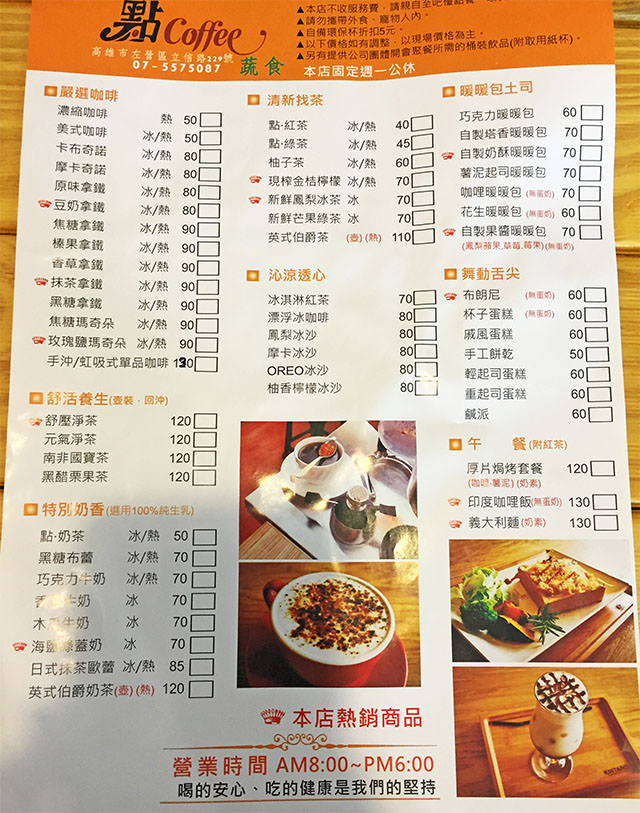
Where is `plates`? Image resolution: width=640 pixels, height=813 pixels. plates is located at coordinates (571, 620), (395, 667).